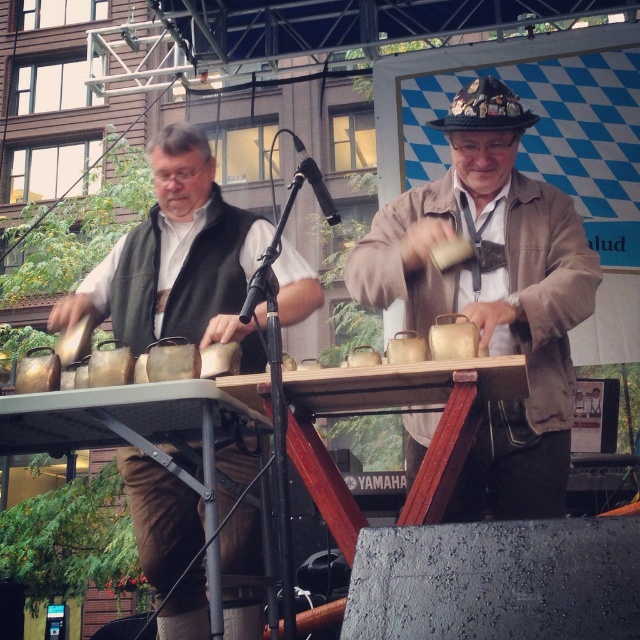
Question: Can you confirm if matte brown leather jacket at center is smaller than matte black vest at left?

Choices:
 (A) yes
 (B) no

Answer: (A)

Question: Is matte brown leather jacket at center positioned behind matte black vest at left?

Choices:
 (A) yes
 (B) no

Answer: (B)

Question: Which object appears closest to the camera in this image?

Choices:
 (A) matte brown leather jacket at center
 (B) matte black vest at left

Answer: (A)

Question: Which point is farther to the camera?

Choices:
 (A) (541, 230)
 (B) (182, 636)

Answer: (B)

Question: Does matte brown leather jacket at center have a lesser width compared to matte black vest at left?

Choices:
 (A) yes
 (B) no

Answer: (A)

Question: Which point is farther to the camera?

Choices:
 (A) (394, 269)
 (B) (166, 474)

Answer: (B)